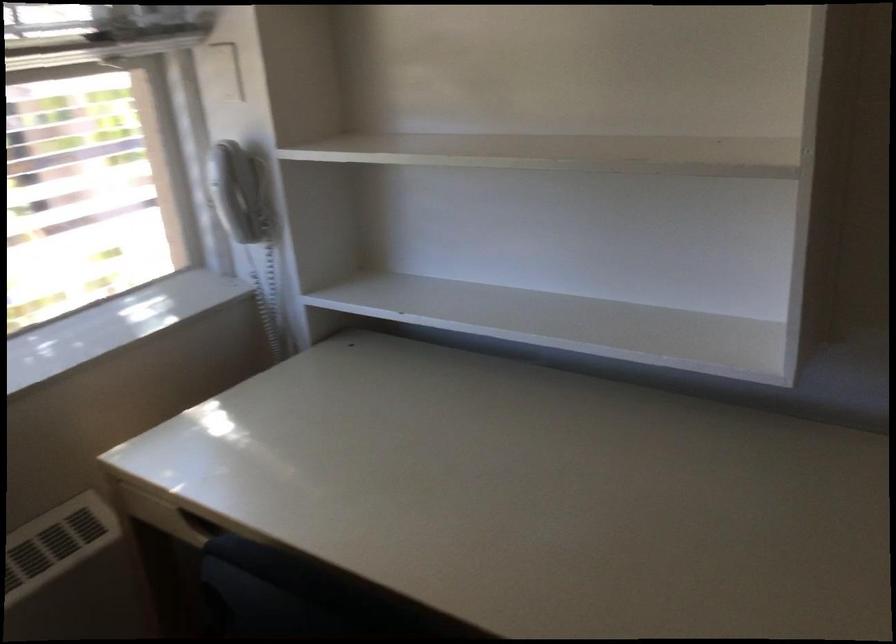
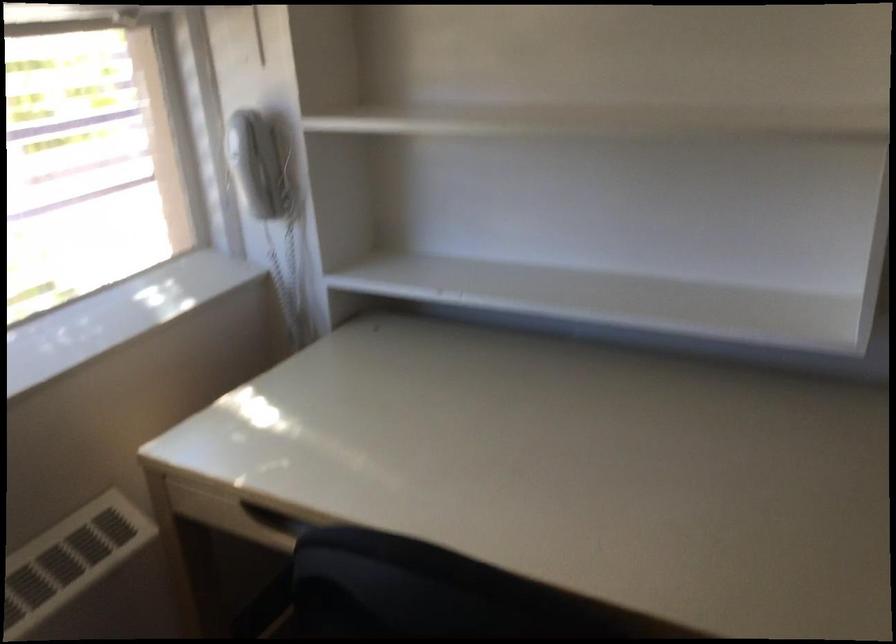
In the second image, find the point that corresponds to pixel 239 192 in the first image.

(261, 165)